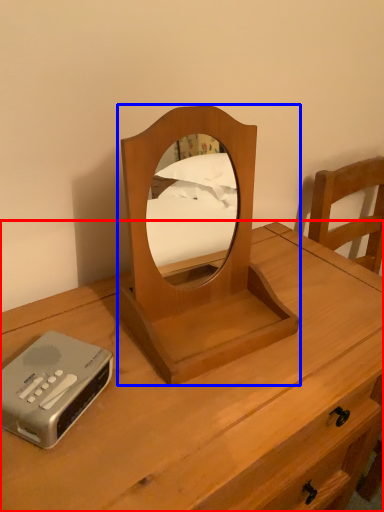
Question: Which object appears farthest to the camera in this image, nightstand (highlighted by a red box) or mirror (highlighted by a blue box)?

Choices:
 (A) nightstand
 (B) mirror

Answer: (B)